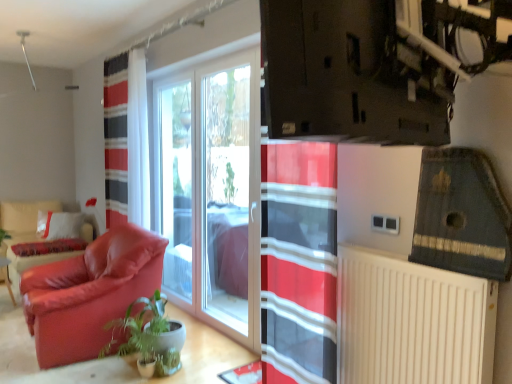
Question: Can you confirm if transparent glass window at center is wider than velvet red armchair at left?

Choices:
 (A) no
 (B) yes

Answer: (A)

Question: Does transparent glass window at center have a lesser width compared to velvet red armchair at left?

Choices:
 (A) yes
 (B) no

Answer: (A)

Question: Is transparent glass window at center to the left of velvet red armchair at left from the viewer's perspective?

Choices:
 (A) yes
 (B) no

Answer: (B)

Question: Is transparent glass window at center positioned with its back to velvet red armchair at left?

Choices:
 (A) no
 (B) yes

Answer: (A)

Question: From the image's perspective, is transparent glass window at center over velvet red armchair at left?

Choices:
 (A) no
 (B) yes

Answer: (B)

Question: Considering their positions, is matte leather armchair at left located in front of or behind white plastic radiator at lower right?

Choices:
 (A) behind
 (B) front

Answer: (A)

Question: In the image, is matte leather armchair at left on the left side or the right side of white plastic radiator at lower right?

Choices:
 (A) right
 (B) left

Answer: (B)

Question: Is matte leather armchair at left inside the boundaries of white plastic radiator at lower right, or outside?

Choices:
 (A) inside
 (B) outside

Answer: (B)

Question: Based on their sizes in the image, would you say matte leather armchair at left is bigger or smaller than white plastic radiator at lower right?

Choices:
 (A) small
 (B) big

Answer: (B)

Question: Is point (153, 316) closer or farther from the camera than point (44, 364)?

Choices:
 (A) closer
 (B) farther

Answer: (B)

Question: Is green glossy plant at lower left bigger or smaller than velvet red armchair at left?

Choices:
 (A) big
 (B) small

Answer: (B)

Question: Is green glossy plant at lower left to the left or to the right of velvet red armchair at left in the image?

Choices:
 (A) right
 (B) left

Answer: (A)

Question: Considering the positions of green glossy plant at lower left and velvet red armchair at left in the image, is green glossy plant at lower left wider or thinner than velvet red armchair at left?

Choices:
 (A) wide
 (B) thin

Answer: (B)

Question: Visually, is green glossy plant at lower left positioned to the left or to the right of matte leather armchair at left?

Choices:
 (A) left
 (B) right

Answer: (B)

Question: Is green glossy plant at lower left taller or shorter than matte leather armchair at left?

Choices:
 (A) short
 (B) tall

Answer: (A)